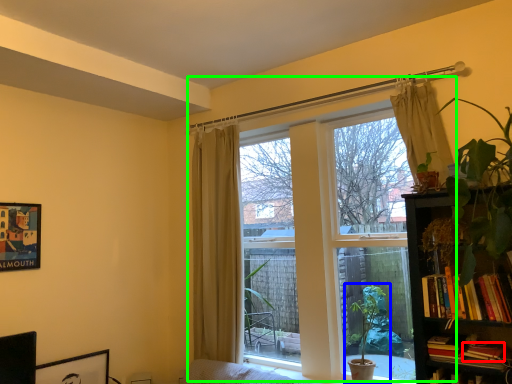
Question: Based on their relative distances, which object is nearer to book (highlighted by a red box)? Choose from houseplant (highlighted by a blue box) and window (highlighted by a green box).

Choices:
 (A) houseplant
 (B) window

Answer: (A)